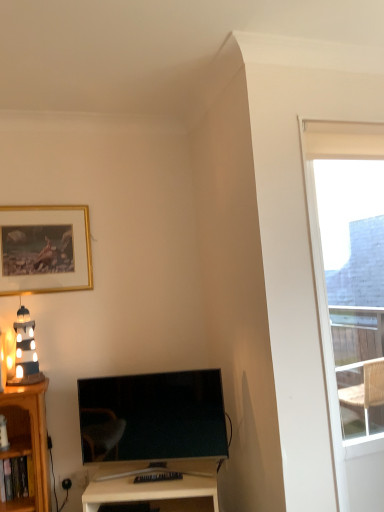
I want to click on vacant region above transparent glass window at upper right (from a real-world perspective), so click(354, 136).